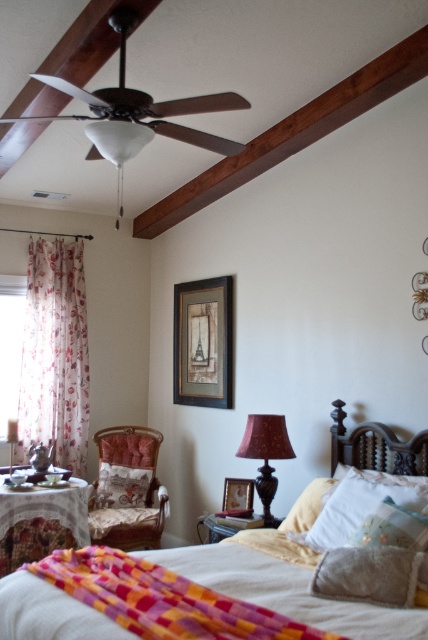
Find the location of `plaid cotton blanket at center`. plaid cotton blanket at center is located at coordinates (162, 598).

Who is positioned more to the left, clear glass window at left or matte brown lamp at center?

Positioned to the left is clear glass window at left.

Is clear glass window at left wider than matte brown lamp at center?

No.

Is point (14, 371) behind point (246, 429)?

Yes, it is behind point (246, 429).

Image resolution: width=428 pixels, height=640 pixels. I want to click on clear glass window at left, so click(11, 344).

Is white quilted pillow at lower right shorter than matte brown lamp at center?

Answer: Yes.

Is point (371, 508) less distant than point (282, 436)?

That is True.

Where is `white quilted pillow at lower right`? The image size is (428, 640). white quilted pillow at lower right is located at coordinates (359, 502).